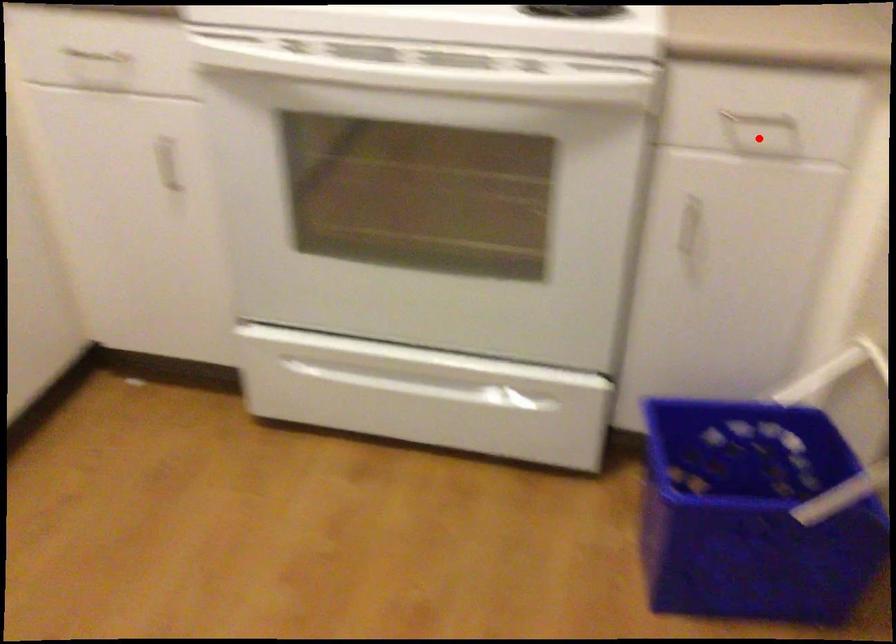
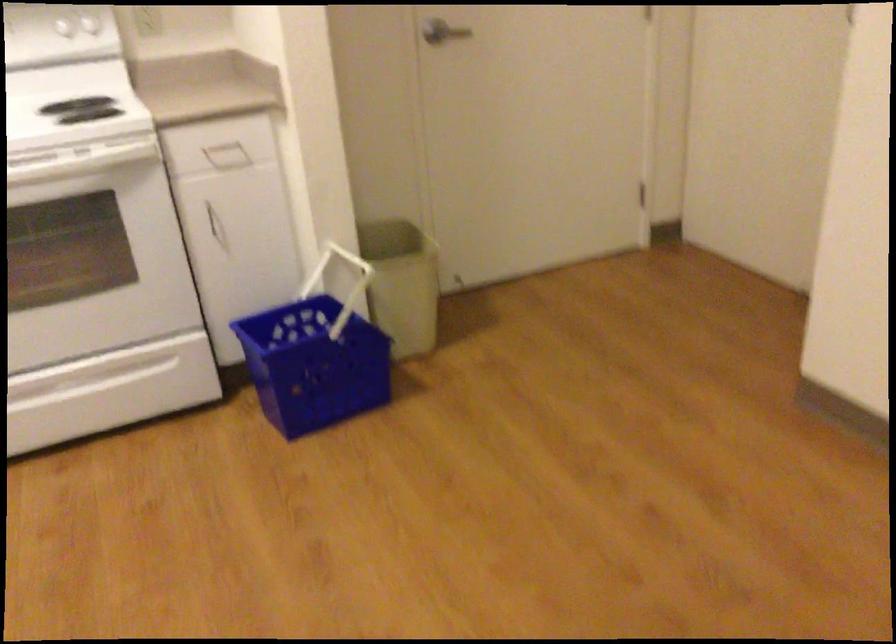
Question: I am providing you with two images of the same scene from different viewpoints. A red point is marked on the first image. Is the red point's position out of view in image 2?

Choices:
 (A) Yes
 (B) No

Answer: (B)